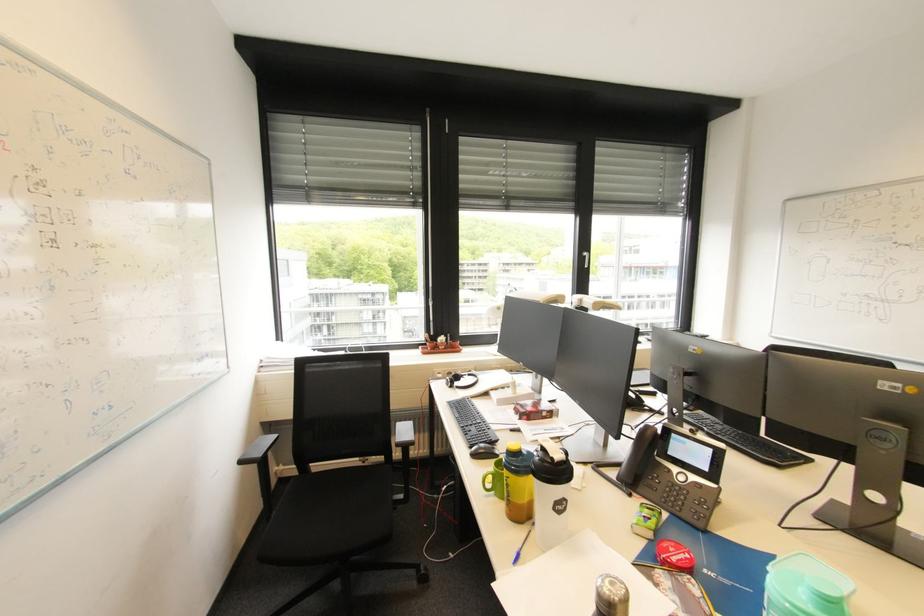
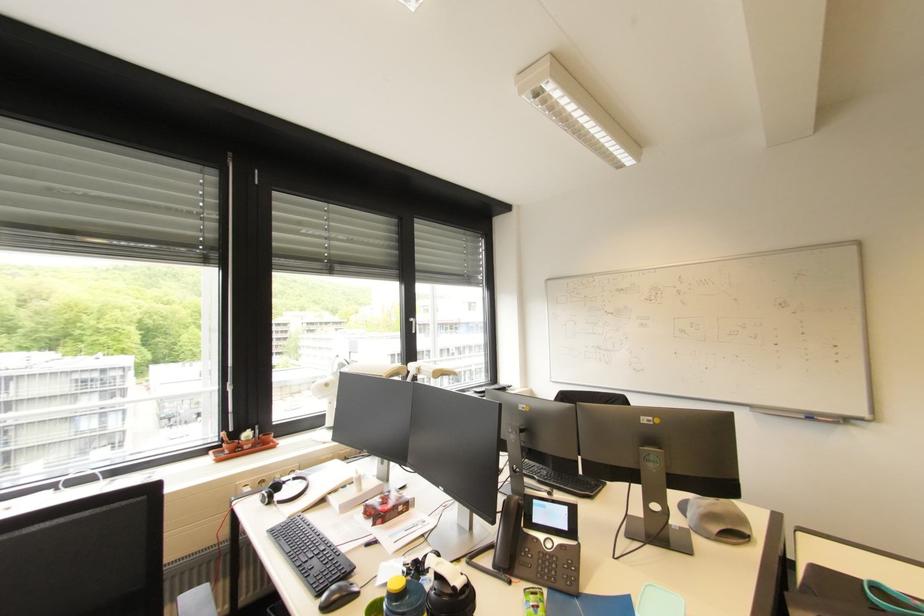
The point at (546, 454) is marked in the first image. Where is the corresponding point in the second image?

(441, 583)